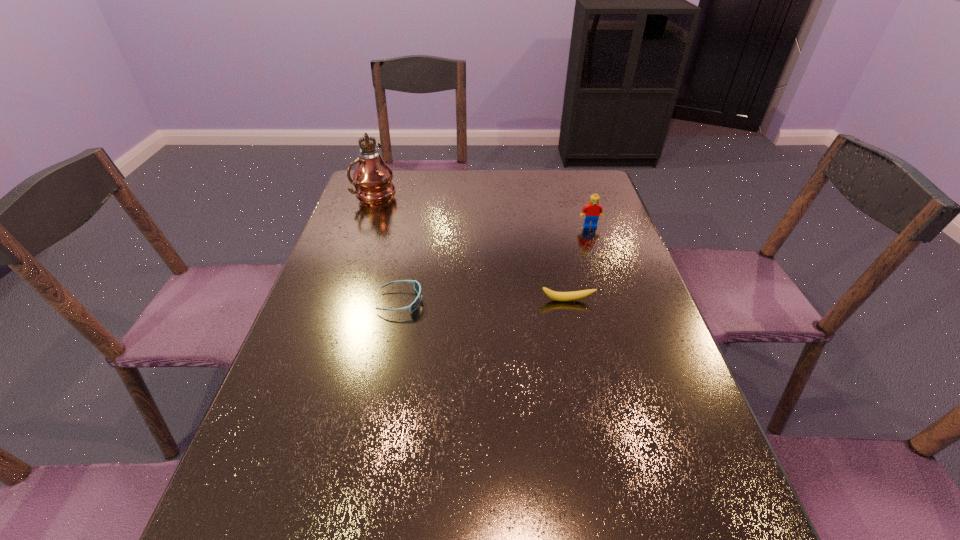
Where is `free space between the second tallest object and the third tallest object`? The height and width of the screenshot is (540, 960). free space between the second tallest object and the third tallest object is located at coordinates (578, 263).

In order to click on vacant area that lies between the second tallest object and the oil lamp in this screenshot , I will do `click(482, 210)`.

Find the location of a particular element. This screenshot has width=960, height=540. free spot between the leftmost object and the shortest object is located at coordinates (388, 247).

You are a GUI agent. You are given a task and a screenshot of the screen. Output one action in this format:
    pyautogui.click(x=<x>, y=<y>)
    Task: Click on the vacant area that lies between the rightmost object and the second object from right to left
    This screenshot has height=540, width=960.
    Given the screenshot: What is the action you would take?
    pyautogui.click(x=578, y=263)

I want to click on free spot between the second farthest object and the third tallest object, so click(x=578, y=263).

The height and width of the screenshot is (540, 960). What are the coordinates of `vacant space in between the second farthest object and the shortest object` in the screenshot? It's located at (495, 264).

Where is `free point between the banana and the second object from left to right`? This screenshot has height=540, width=960. free point between the banana and the second object from left to right is located at coordinates (484, 301).

What are the coordinates of `free point between the third object from right to left and the rightmost object` in the screenshot? It's located at (495, 264).

Where is `vacant point located between the rightmost object and the shortest object`? vacant point located between the rightmost object and the shortest object is located at coordinates (495, 264).

The image size is (960, 540). Identify the location of free spot between the leftmost object and the second tallest object. (482, 210).